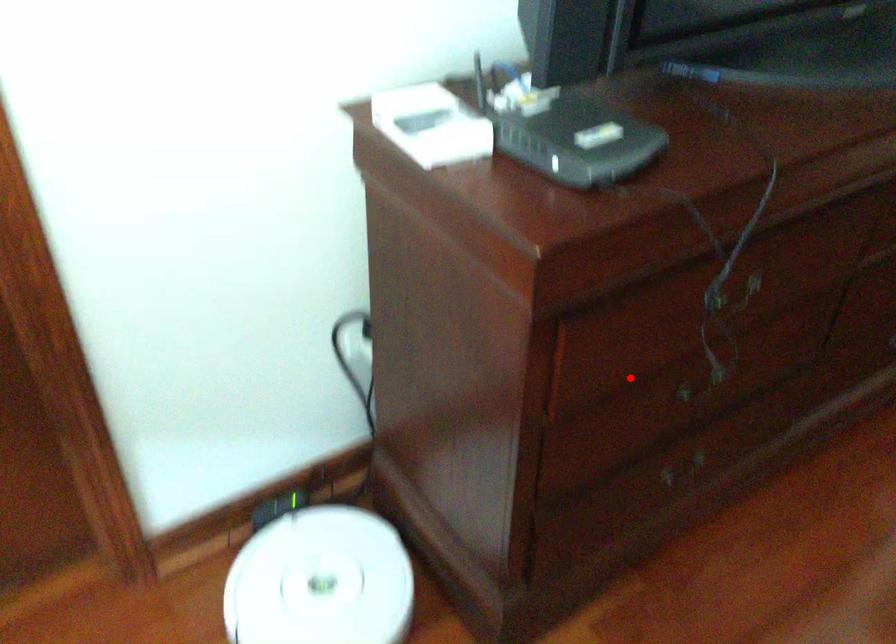
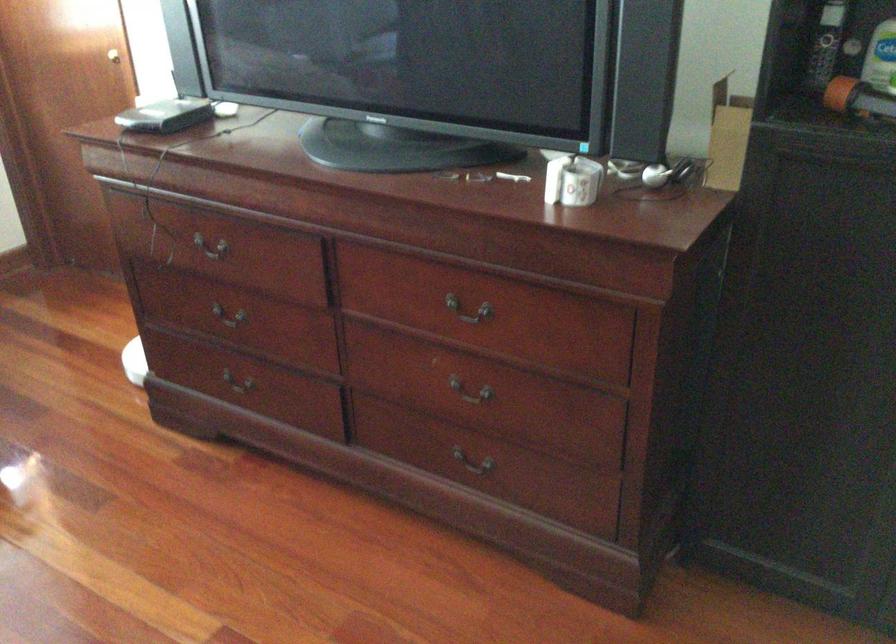
In the second image, find the point that corresponds to the highlighted location in the first image.

(229, 313)